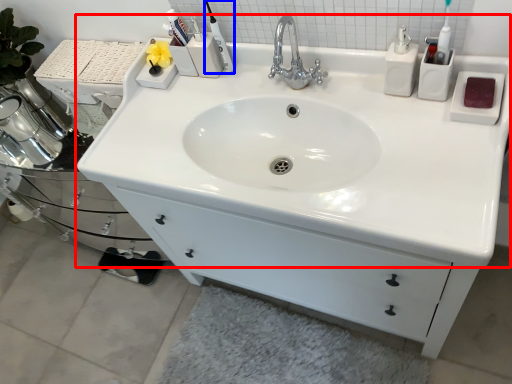
Question: Among these objects, which one is farthest to the camera, sink (highlighted by a red box) or toiletry (highlighted by a blue box)?

Choices:
 (A) sink
 (B) toiletry

Answer: (B)